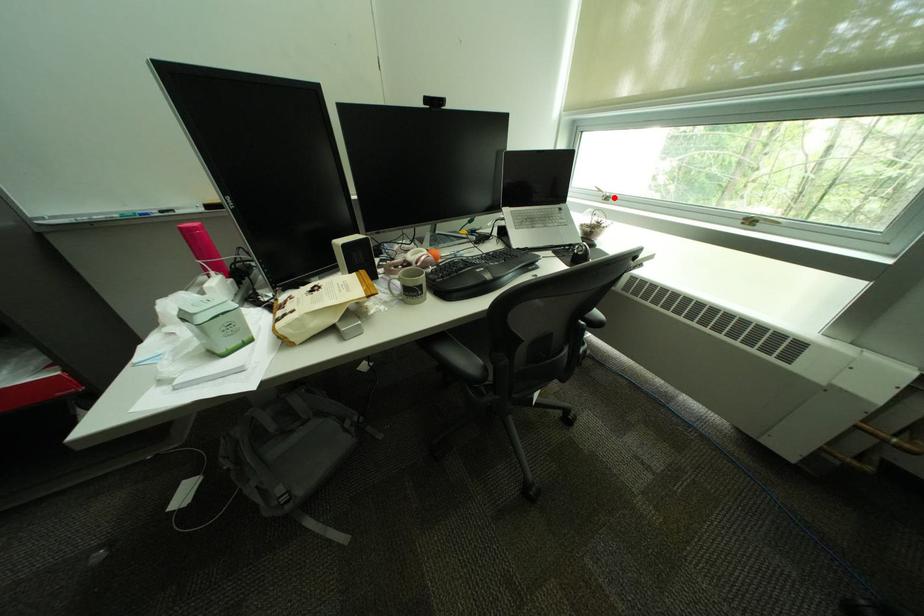
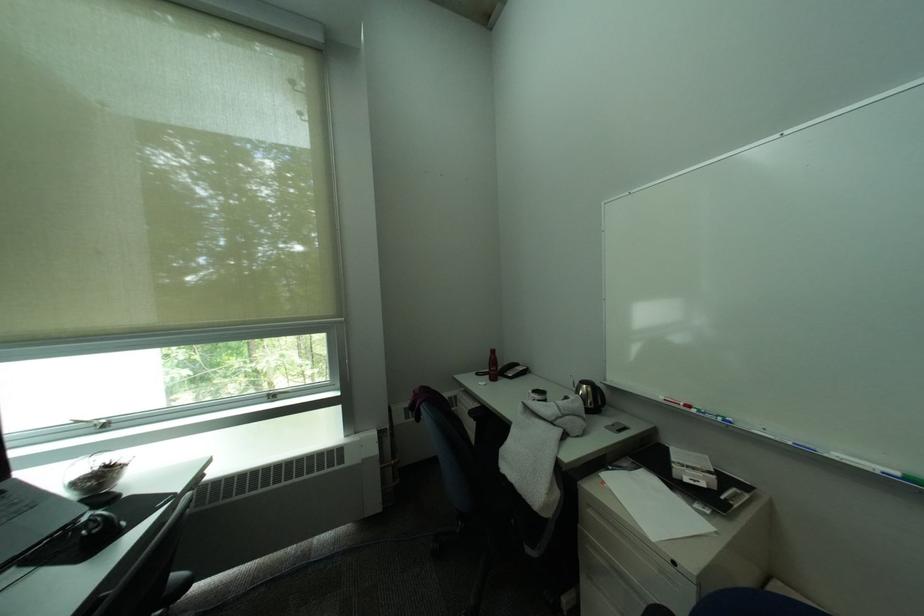
Where in the second image is the point corresponding to the highlighted location from the first image?

(106, 427)